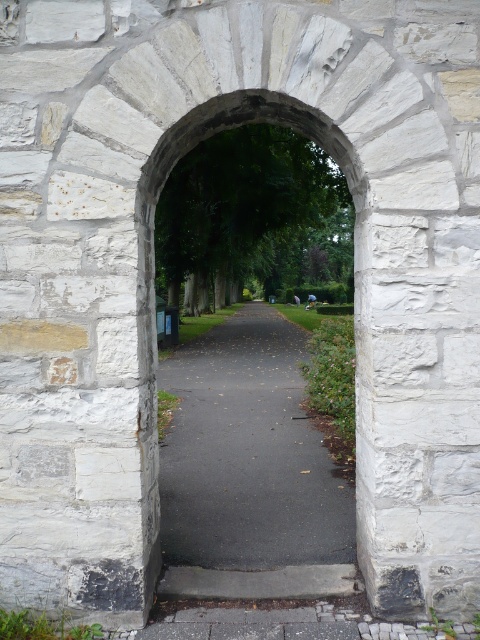
You are standing at the base of the stone archway and want to walk towards the pathway. There are two points marked on the ground ahead of you. The first is at point (204, 552) and the second is at point (333, 508). Which point should you step on first if you want to follow the direction the pathway is leading?

You should step on point (204, 552) first because it is in front of point (333, 508) along the pathway.

You are standing in front of the stone archway at center and the black asphalt path at center. Which one appears larger from your perspective?

The stone archway at center is bigger than the black asphalt path at center, so the stone archway at center appears larger from your perspective.

You are standing in front of the stone archway at center. If you walk straight through it, which direction will you be facing relative to the pathway that extends beyond it?

Since the stone archway at center is positioned at point (248, 458), walking straight through it would direct you towards the pathway that extends beyond it, so you would be facing forward along the path.